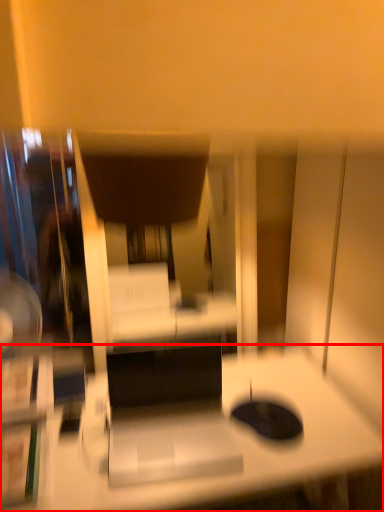
Question: Where is desk (annotated by the red box) located in relation to swivel chair in the image?

Choices:
 (A) left
 (B) right

Answer: (B)